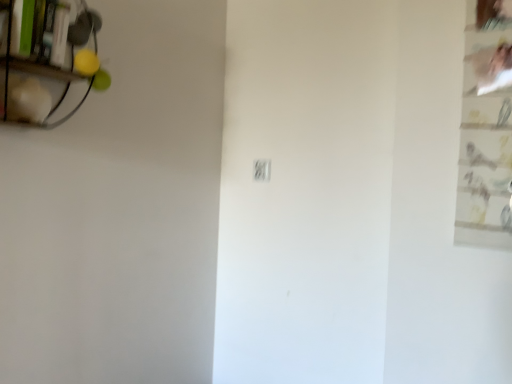
Locate an element on the screen. wooden shelf at upper left is located at coordinates (46, 56).

Measure the distance between wooden shelf at upper left and camera.

wooden shelf at upper left is 35.52 inches away from camera.

What do you see at coordinates (46, 56) in the screenshot? The height and width of the screenshot is (384, 512). I see `wooden shelf at upper left` at bounding box center [46, 56].

Locate an element on the screen. wooden shelf at upper left is located at coordinates (46, 56).